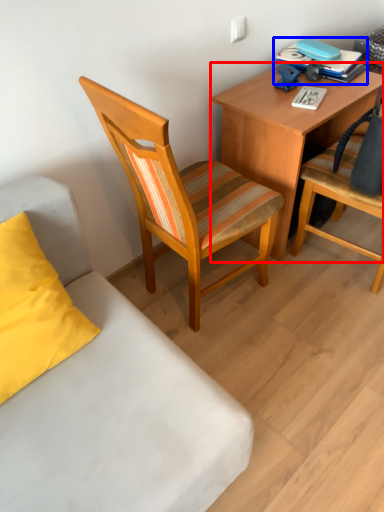
Question: Which object is closer to the camera taking this photo, desk (highlighted by a red box) or book (highlighted by a blue box)?

Choices:
 (A) desk
 (B) book

Answer: (A)